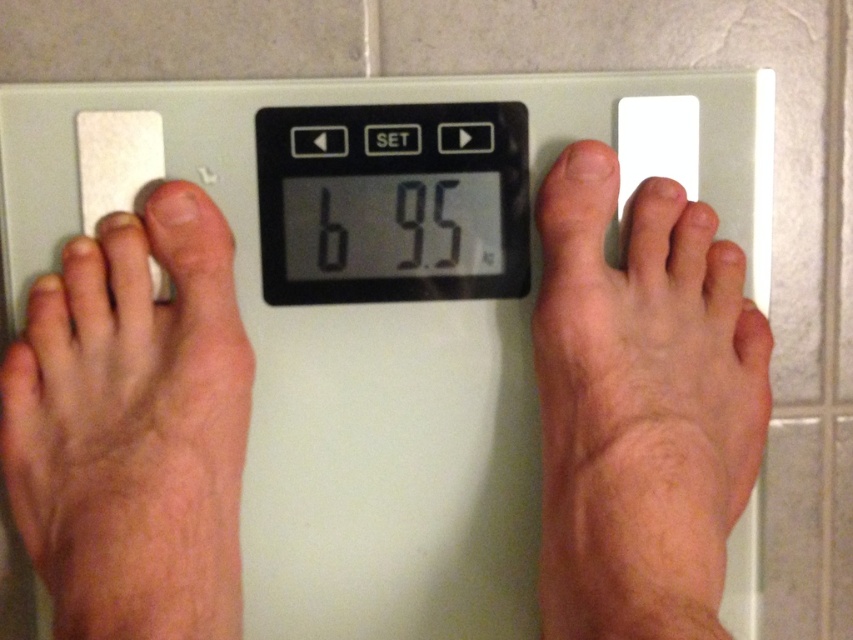
Does skinny flesh-toned foot at right have a greater height compared to white plastic scale at center?

Yes.

Is point (698, 448) more distant than point (73, 189)?

No, (698, 448) is in front of (73, 189).

Does point (714, 627) come farther from viewer compared to point (9, 236)?

No, (714, 627) is in front of (9, 236).

This screenshot has width=853, height=640. Find the location of `skinny flesh-toned foot at right`. skinny flesh-toned foot at right is located at coordinates (640, 404).

Between point (711, 580) and point (206, 209), which one is positioned behind?

Point (206, 209)

Who is taller, skinny bare feet at center or pink skin at left?

skinny bare feet at center

Which is behind, point (682, 384) or point (119, 602)?

Positioned behind is point (682, 384).

At what (x,y) coordinates should I click in order to perform the action: click on skinny bare feet at center. Please return your answer as a coordinate pair (x, y). The height and width of the screenshot is (640, 853). Looking at the image, I should click on (640, 404).

Which is more to the left, skinny bare feet at center or skinny flesh-toned foot at right?

skinny bare feet at center is more to the left.

Does skinny bare feet at center appear over skinny flesh-toned foot at right?

Yes.

Measure the distance between skinny bare feet at center and camera.

They are 14.83 inches apart.

This screenshot has width=853, height=640. I want to click on skinny bare feet at center, so click(640, 404).